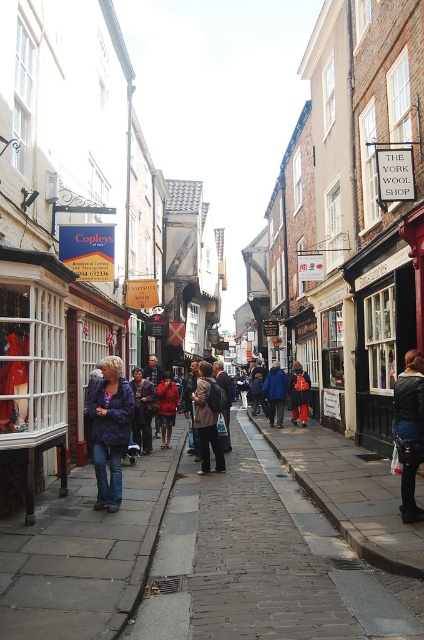
Does point (398, 429) come behind point (292, 372)?

No, (398, 429) is in front of (292, 372).

Identify the location of leather jacket at center. Image resolution: width=424 pixels, height=640 pixels. pyautogui.click(x=410, y=429).

What are the coordinates of `leather jacket at center` in the screenshot? It's located at (410, 429).

Who is more distant from viewer, (147, 381) or (164, 403)?

Point (164, 403)

In the scene shown: Which of these two, denim jacket at center or red wool coat at center, stands shorter?

With less height is red wool coat at center.

You are a GUI agent. You are given a task and a screenshot of the screen. Output one action in this format:
    pyautogui.click(x=<x>, y=<y>)
    Task: Click on the denim jacket at center
    Image resolution: width=424 pixels, height=640 pixels.
    Given the screenshot: What is the action you would take?
    pyautogui.click(x=142, y=410)

Describe the element at coordinates (84, 554) in the screenshot. I see `dark gray cobblestone pavement at lower left` at that location.

Which of these two, dark gray cobblestone pavement at lower left or denim jacket at left, stands shorter?

dark gray cobblestone pavement at lower left is shorter.

Where is `dark gray cobblestone pavement at lower left`? dark gray cobblestone pavement at lower left is located at coordinates (84, 554).